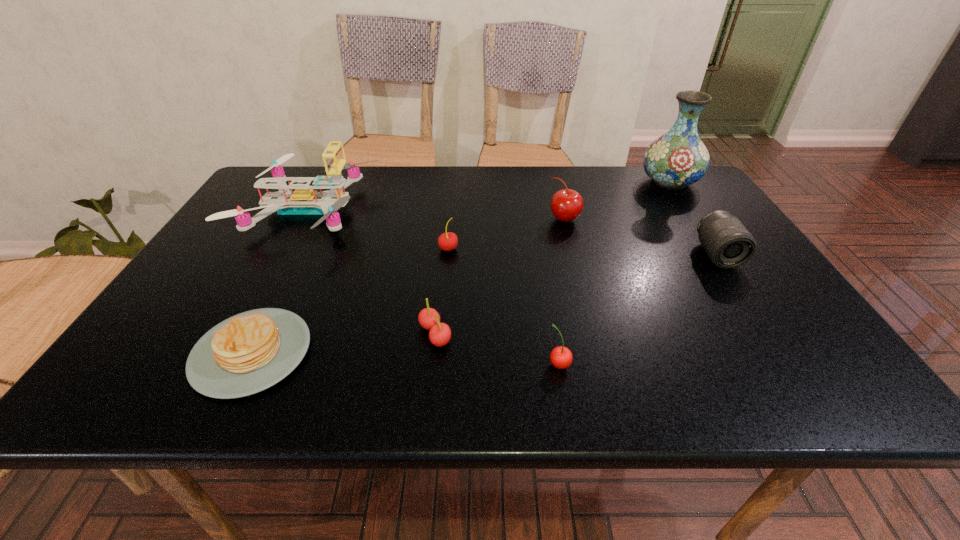
Identify the location of vacant space located 0.080m on the front of the vase. pos(689,212).

Find the location of a particular element. The width and height of the screenshot is (960, 540). free space located 0.380m on the front-facing side of the drone is located at coordinates (505, 210).

Locate an element on the screen. Image resolution: width=960 pixels, height=540 pixels. free space located 0.210m on the left of the third object from right to left is located at coordinates (474, 219).

The height and width of the screenshot is (540, 960). In order to click on free spot located on the surface of the telephoto lens in this screenshot , I will do `click(746, 300)`.

Where is `vacant space positioned 0.120m on the left of the second farthest cherry`? The width and height of the screenshot is (960, 540). vacant space positioned 0.120m on the left of the second farthest cherry is located at coordinates (392, 248).

The image size is (960, 540). Identify the location of vacant space located 0.130m on the right of the fourth object from right to left. (637, 364).

Find the location of a particular element. blank space located on the right of the second nearest cherry is located at coordinates (597, 335).

Find the location of a particular element. vacant area located on the left of the pancake is located at coordinates coord(164,353).

You are a GUI agent. You are given a task and a screenshot of the screen. Output one action in this format:
    pyautogui.click(x=<x>, y=<y>)
    Task: Click on the vase that is at the far edge
    The height and width of the screenshot is (540, 960).
    Given the screenshot: What is the action you would take?
    pyautogui.click(x=678, y=158)

Identify the location of drone located at the far edge. (304, 200).